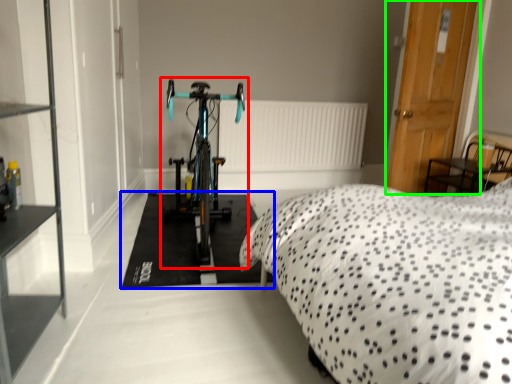
Question: Based on their relative distances, which object is farther from bicycle (highlighted by a red box)? Choose from flat (highlighted by a blue box) and door (highlighted by a green box).

Choices:
 (A) flat
 (B) door

Answer: (B)